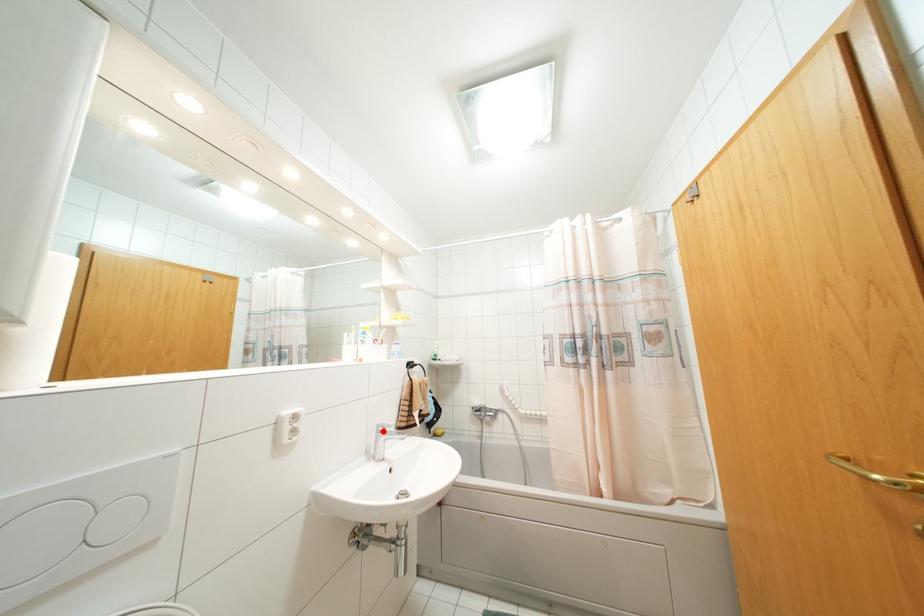
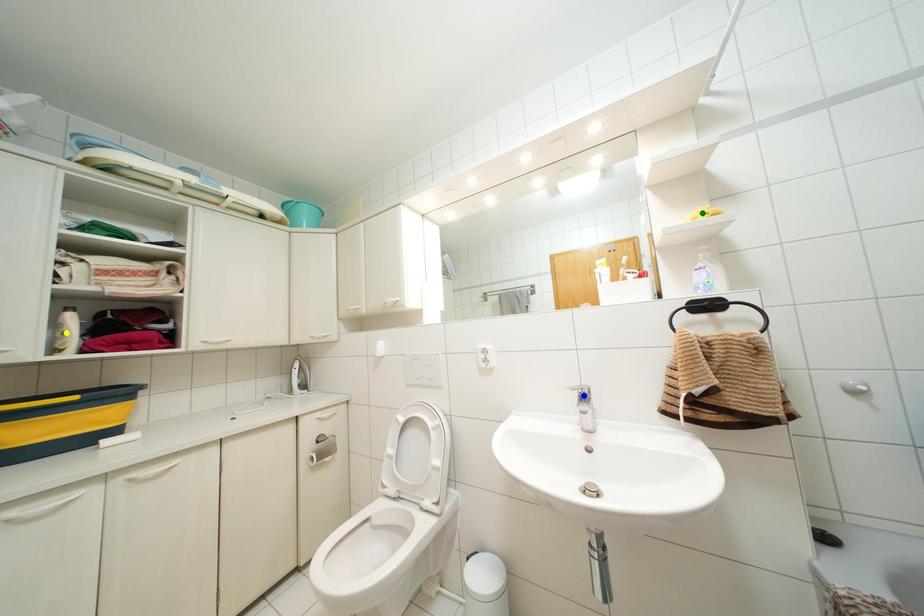
Question: I am providing you with two images of the same scene from different viewpoints. A red point is marked on the first image. You are given multiple points on the second image. In image 2, which mark is for the same physical point as the one in image 1?

Choices:
 (A) green point
 (B) blue point
 (C) yellow point

Answer: (B)